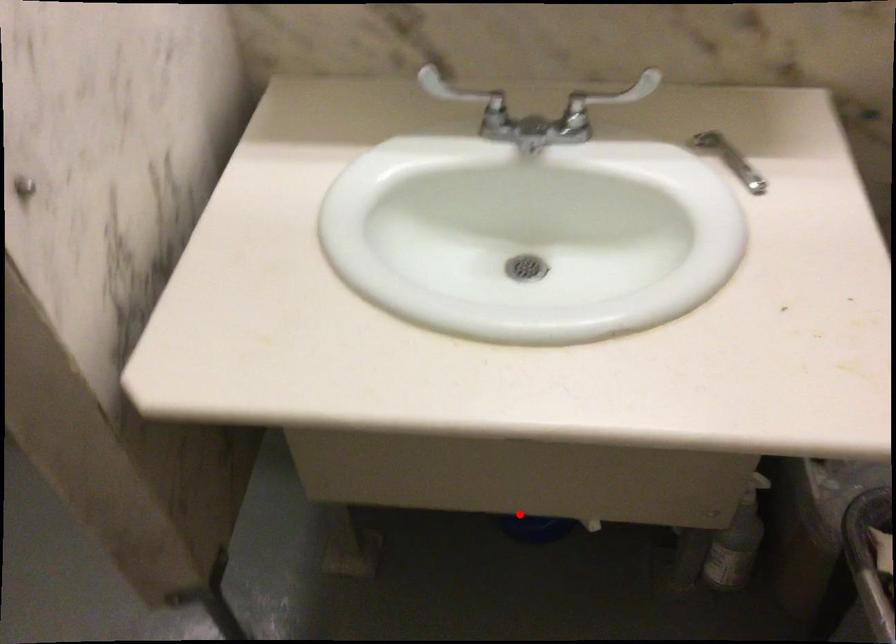
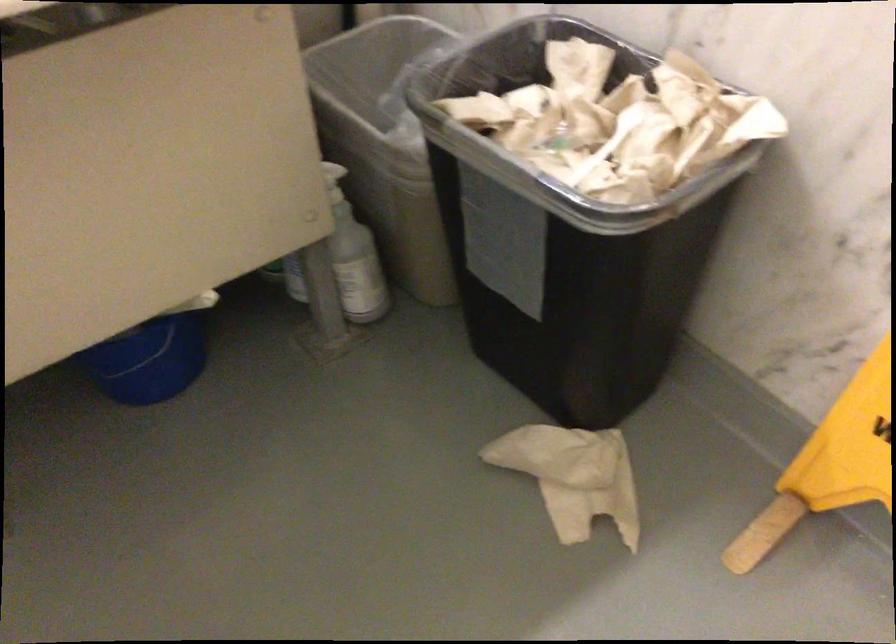
Question: I am providing you with two images of the same scene from different viewpoints. A red point is shown in image1. For the corresponding object point in image2, is it positioned nearer or farther from the camera?

Choices:
 (A) Nearer
 (B) Farther

Answer: (A)